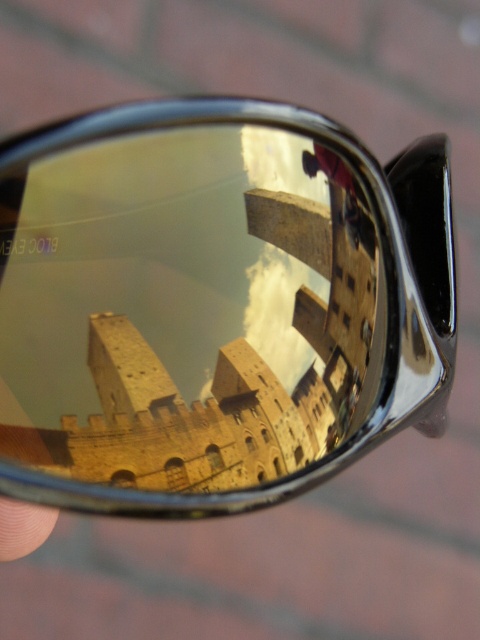
Question: Among these objects, which one is nearest to the camera?

Choices:
 (A) skinsmoothhand at lower left
 (B) shiny metallic sunglasses at center

Answer: (B)

Question: Which object is farther from the camera taking this photo?

Choices:
 (A) skinsmoothhand at lower left
 (B) shiny metallic sunglasses at center

Answer: (A)

Question: Which point appears farthest from the camera in this image?

Choices:
 (A) (20, 556)
 (B) (269, 480)

Answer: (A)

Question: Is shiny metallic sunglasses at center below skinsmoothhand at lower left?

Choices:
 (A) no
 (B) yes

Answer: (A)

Question: Can you confirm if shiny metallic sunglasses at center is wider than skinsmoothhand at lower left?

Choices:
 (A) yes
 (B) no

Answer: (A)

Question: Does shiny metallic sunglasses at center lie behind skinsmoothhand at lower left?

Choices:
 (A) yes
 (B) no

Answer: (B)